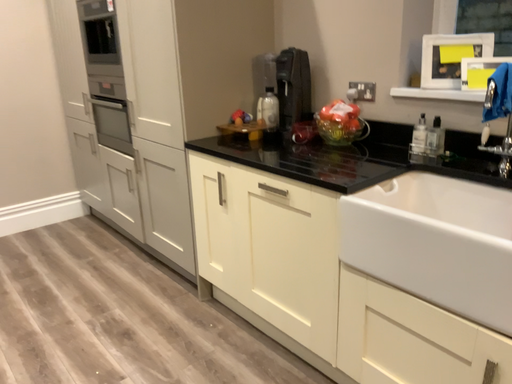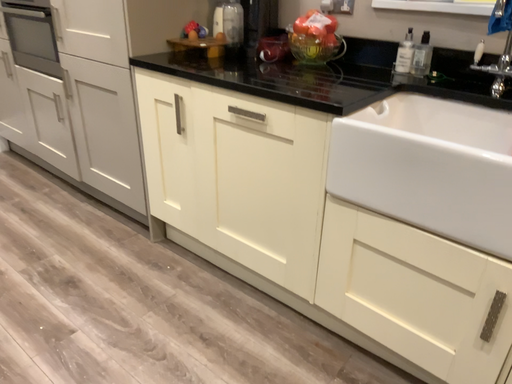
Question: Which way did the camera rotate in the video?

Choices:
 (A) rotated downward
 (B) rotated upward

Answer: (A)